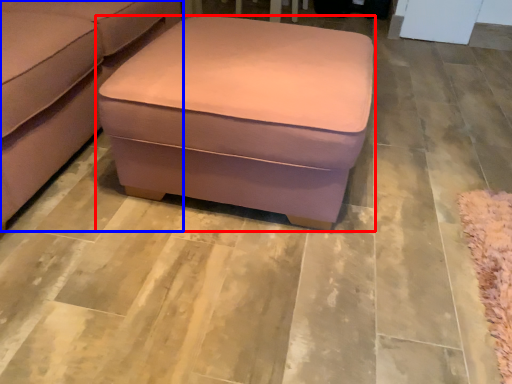
Question: Which object appears closest to the camera in this image, table (highlighted by a red box) or studio couch (highlighted by a blue box)?

Choices:
 (A) table
 (B) studio couch

Answer: (B)